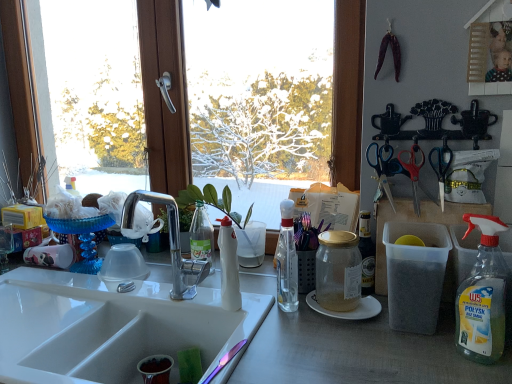
Question: Is blue plastic scissors at upper right, which appears as the 1th scissors when viewed from the left, far from white glossy coffee cup at left?

Choices:
 (A) yes
 (B) no

Answer: (A)

Question: From a real-world perspective, is blue plastic scissors at upper right, which appears as the 1th scissors when viewed from the left, positioned under white glossy coffee cup at left based on gravity?

Choices:
 (A) yes
 (B) no

Answer: (B)

Question: Is blue plastic scissors at upper right, which appears as the 1th scissors when viewed from the left, at the right side of white glossy coffee cup at left?

Choices:
 (A) yes
 (B) no

Answer: (A)

Question: Is the surface of blue plastic scissors at upper right, which appears as the 1th scissors when viewed from the left, in direct contact with white glossy coffee cup at left?

Choices:
 (A) yes
 (B) no

Answer: (B)

Question: Does blue plastic scissors at upper right, arranged as the 3th scissors when viewed from the right, have a lesser height compared to white glossy coffee cup at left?

Choices:
 (A) yes
 (B) no

Answer: (B)

Question: Considering the relative sizes of blue plastic scissors at upper right, which appears as the 1th scissors when viewed from the left, and white glossy coffee cup at left in the image provided, is blue plastic scissors at upper right, which appears as the 1th scissors when viewed from the left, bigger than white glossy coffee cup at left?

Choices:
 (A) no
 (B) yes

Answer: (B)

Question: From the image's perspective, would you say transparent glass window at center is positioned over white matte bottle at center, the fourth bottle from the right?

Choices:
 (A) yes
 (B) no

Answer: (A)

Question: Is transparent glass window at center shorter than white matte bottle at center, the fourth bottle from the right?

Choices:
 (A) no
 (B) yes

Answer: (A)

Question: Does transparent glass window at center have a greater width compared to white matte bottle at center, the fourth bottle from the right?

Choices:
 (A) yes
 (B) no

Answer: (A)

Question: Does transparent glass window at center have a larger size compared to white matte bottle at center, the fourth bottle from the right?

Choices:
 (A) no
 (B) yes

Answer: (B)

Question: Is white matte bottle at center, the fourth bottle from the right, located within transparent glass window at center?

Choices:
 (A) yes
 (B) no

Answer: (B)

Question: Is transparent glass window at center taller than white matte bottle at center, the fourth bottle from the right?

Choices:
 (A) yes
 (B) no

Answer: (A)

Question: Is white glossy sink at lower left located within transparent glass window at center?

Choices:
 (A) no
 (B) yes

Answer: (A)